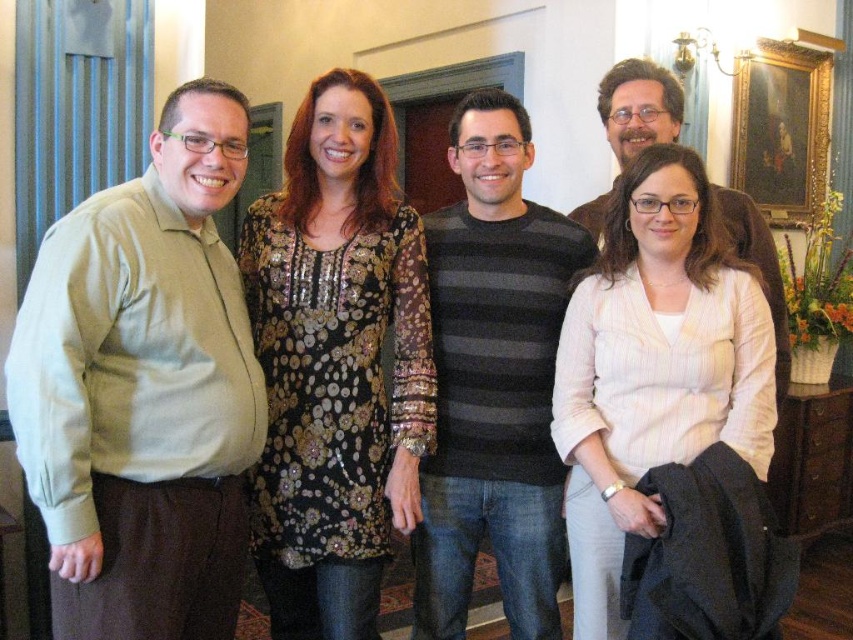
Who is higher up, shiny sequined dress at center or gold-framed painting at upper right?

Positioned higher is gold-framed painting at upper right.

Which is more to the left, shiny sequined dress at center or gold-framed painting at upper right?

shiny sequined dress at center is more to the left.

Between point (306, 241) and point (804, 173), which one is positioned behind?

Point (804, 173)

The height and width of the screenshot is (640, 853). I want to click on shiny sequined dress at center, so click(335, 362).

Measure the distance from light green shirt at left to shiny sequined dress at center.

A distance of 31.54 centimeters exists between light green shirt at left and shiny sequined dress at center.

Is light green shirt at left smaller than shiny sequined dress at center?

Incorrect, light green shirt at left is not smaller in size than shiny sequined dress at center.

Find the location of `light green shirt at left`. light green shirt at left is located at coordinates (143, 388).

You are a GUI agent. You are given a task and a screenshot of the screen. Output one action in this format:
    pyautogui.click(x=<x>, y=<y>)
    Task: Click on the light green shirt at left
    
    Given the screenshot: What is the action you would take?
    pyautogui.click(x=143, y=388)

The width and height of the screenshot is (853, 640). What do you see at coordinates (492, 380) in the screenshot? I see `striped sweater at center` at bounding box center [492, 380].

Can you confirm if striped sweater at center is smaller than matte brown jacket at upper right?

Correct, striped sweater at center occupies less space than matte brown jacket at upper right.

This screenshot has height=640, width=853. I want to click on striped sweater at center, so click(492, 380).

This screenshot has width=853, height=640. Identify the location of striped sweater at center. (492, 380).